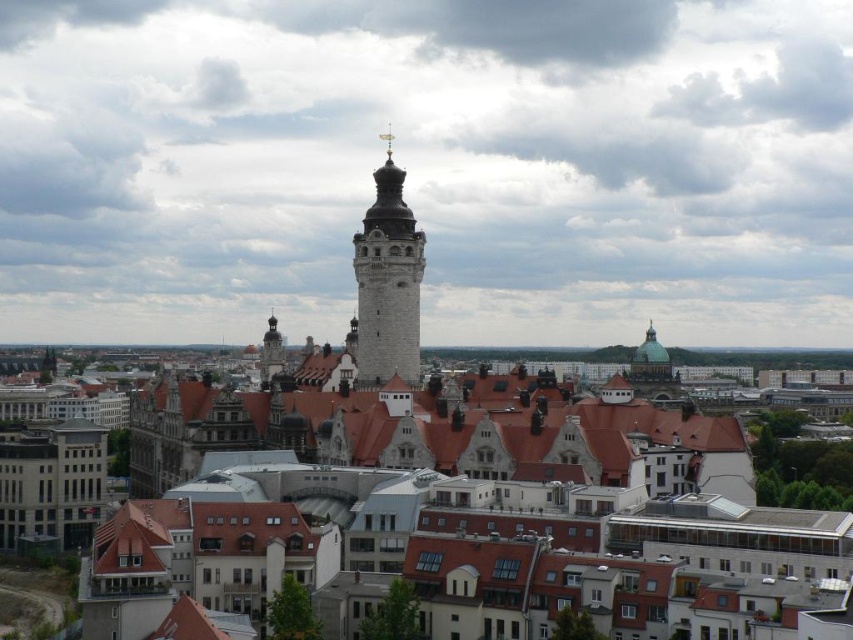
Question: Is matte stone tower at center to the right of white stone tower at center from the viewer's perspective?

Choices:
 (A) yes
 (B) no

Answer: (A)

Question: Which object appears closest to the camera in this image?

Choices:
 (A) matte stone tower at center
 (B) white stone tower at center

Answer: (A)

Question: Among these points, which one is farthest from the camera?

Choices:
 (A) (396, 428)
 (B) (398, 189)

Answer: (B)

Question: Is matte stone tower at center positioned before white stone tower at center?

Choices:
 (A) yes
 (B) no

Answer: (A)

Question: Is matte stone tower at center further to the viewer compared to white stone tower at center?

Choices:
 (A) yes
 (B) no

Answer: (B)

Question: Which of the following is the farthest from the observer?

Choices:
 (A) (722, 483)
 (B) (364, 259)

Answer: (B)